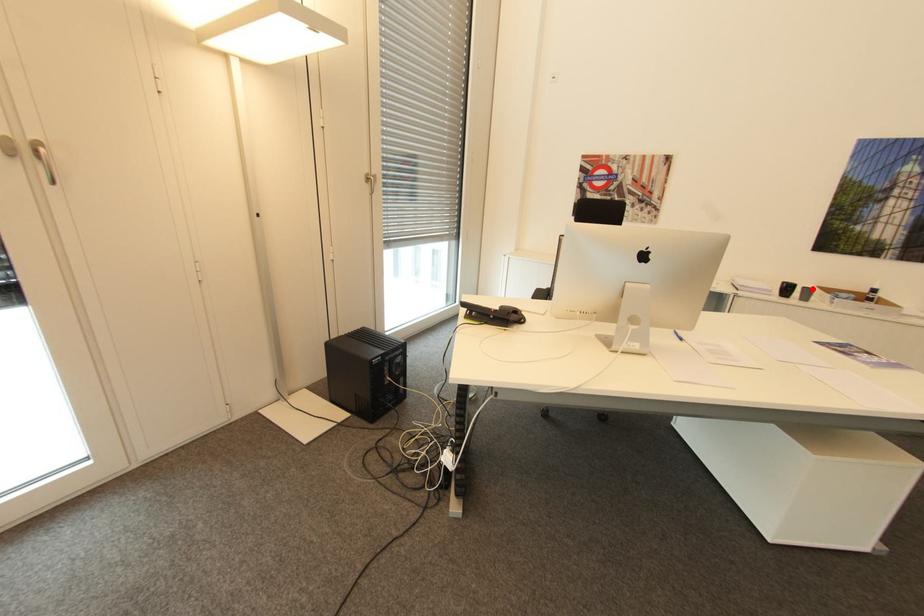
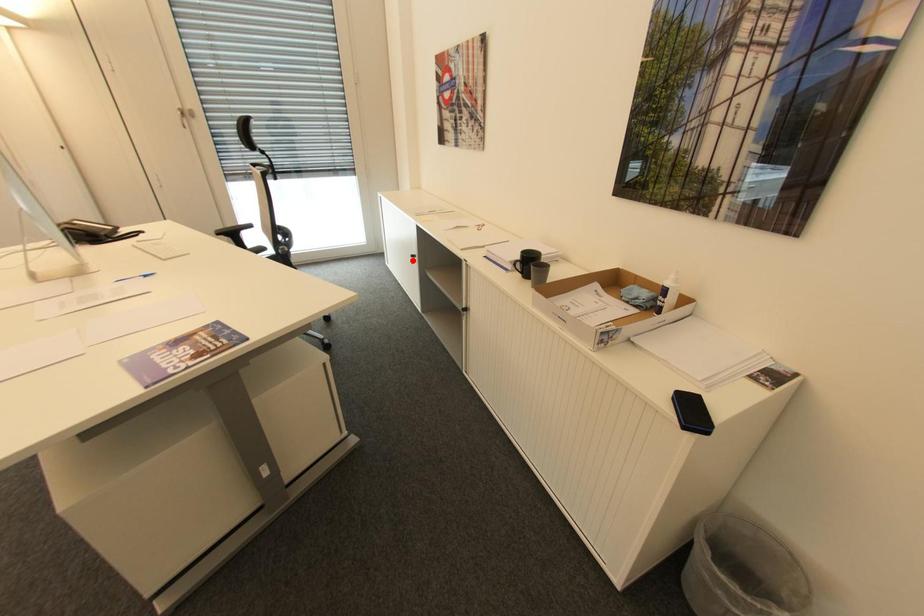
I am providing you with two images of the same scene from different viewpoints. A red point is marked on the first image and another point is marked on the second image. Is the red point in image1 aligned with the point shown in image2?

No